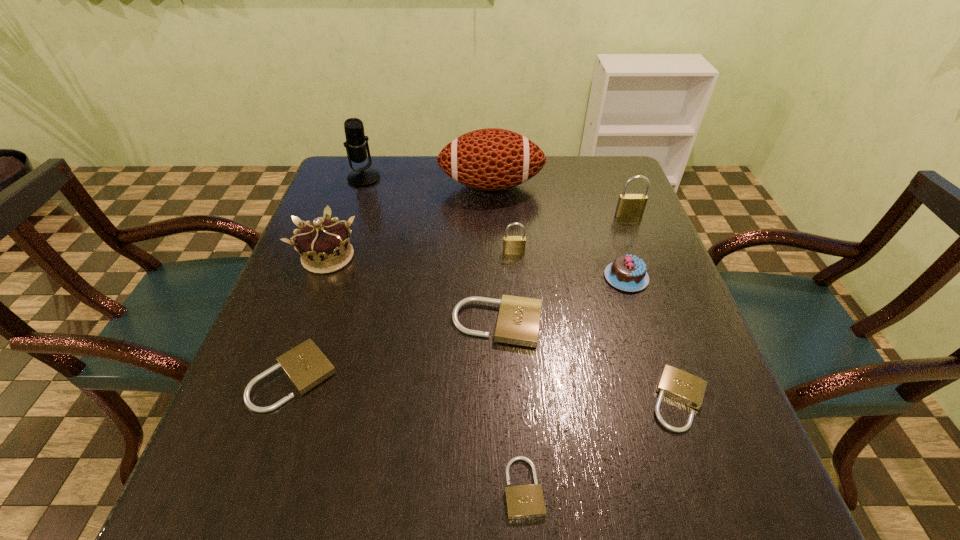
Where is `free space at the near right corner of the desktop`? Image resolution: width=960 pixels, height=540 pixels. free space at the near right corner of the desktop is located at coordinates (684, 488).

Locate an element on the screen. The image size is (960, 540). free space that is in between the leftmost padlock and the fifth nearest padlock is located at coordinates (404, 315).

Find the location of `vacant area between the microphone and the bigger brass padlock`. vacant area between the microphone and the bigger brass padlock is located at coordinates (496, 197).

At what (x,y) coordinates should I click in order to perform the action: click on free spot between the shortest object and the microphone. Please return your answer as a coordinate pair (x, y). Image resolution: width=960 pixels, height=540 pixels. Looking at the image, I should click on (444, 333).

Image resolution: width=960 pixels, height=540 pixels. I want to click on unoccupied position between the fifth shortest object and the seventh tallest object, so click(562, 301).

What are the coordinates of `vacant space that is in between the nearer brass padlock and the second shortest object` in the screenshot? It's located at (596, 326).

Locate an element on the screen. Image resolution: width=960 pixels, height=540 pixels. unoccupied position between the sixth tallest object and the third biggest beige padlock is located at coordinates (653, 339).

The width and height of the screenshot is (960, 540). Identify the location of empty location between the fourth shortest object and the chocolate cake. (562, 301).

Where is `empty space that is in between the left brass padlock and the fifth shortest object`? The height and width of the screenshot is (540, 960). empty space that is in between the left brass padlock and the fifth shortest object is located at coordinates pos(570,265).

Locate an element on the screen. vacant area between the farthest padlock and the nearer brass padlock is located at coordinates (571, 234).